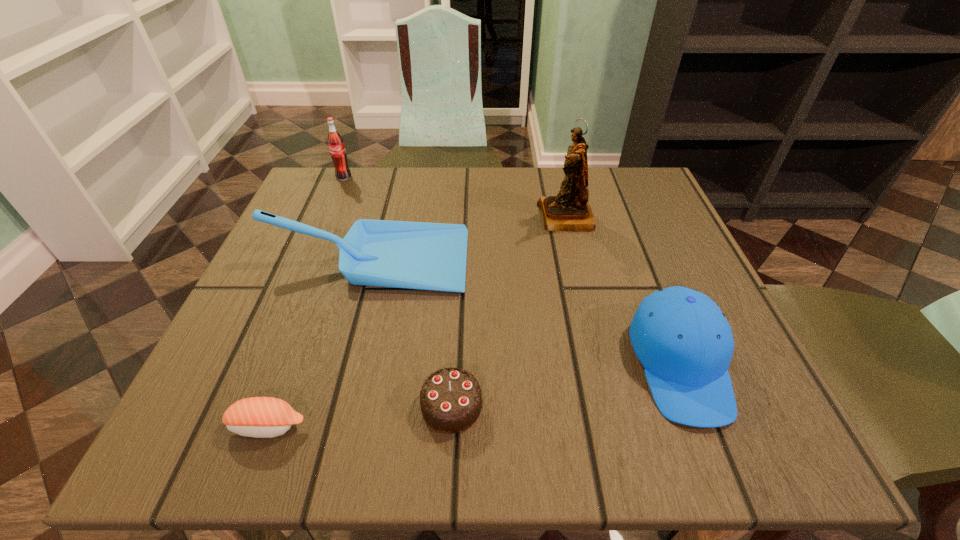
The image size is (960, 540). I want to click on figurine, so click(568, 211).

Where is `the second tallest object`? This screenshot has width=960, height=540. the second tallest object is located at coordinates (336, 145).

Locate an element on the screen. The image size is (960, 540). soda bottle is located at coordinates (336, 145).

You are a GUI agent. You are given a task and a screenshot of the screen. Output one action in this format:
    pyautogui.click(x=<x>, y=<y>)
    Task: Click on the dustpan
    
    Given the screenshot: What is the action you would take?
    pyautogui.click(x=415, y=255)

This screenshot has width=960, height=540. Identify the location of cap. (684, 342).

The image size is (960, 540). I want to click on chocolate cake, so click(450, 399).

Locate an element on the screen. Image resolution: width=960 pixels, height=540 pixels. the shortest object is located at coordinates (262, 417).

Image resolution: width=960 pixels, height=540 pixels. What are the coordinates of `blank space located 0.300m on the front-facing side of the tallest object` in the screenshot? It's located at (401, 217).

Identify the location of vacant region located on the front-facing side of the tallest object. (484, 217).

Identify the location of free space located 0.060m on the front-facing side of the tallest object. (512, 217).